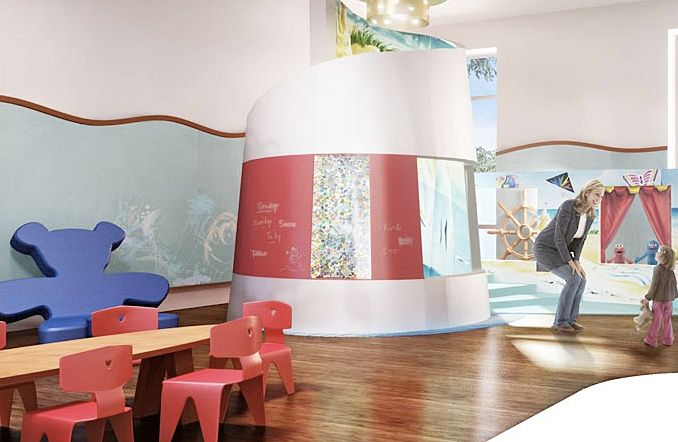
Image resolution: width=678 pixels, height=442 pixels. Identify the location of big blue bear chair. (81, 243), (62, 285).